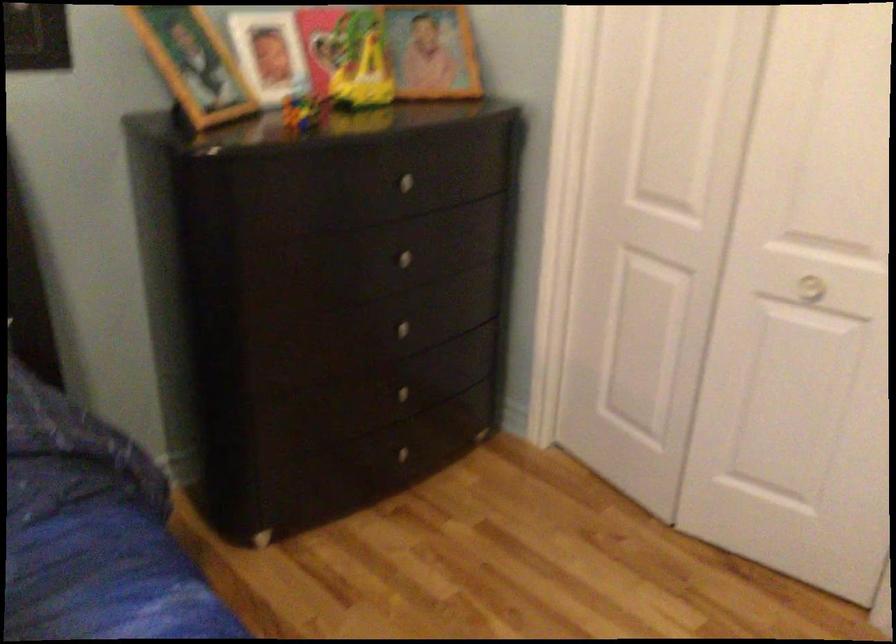
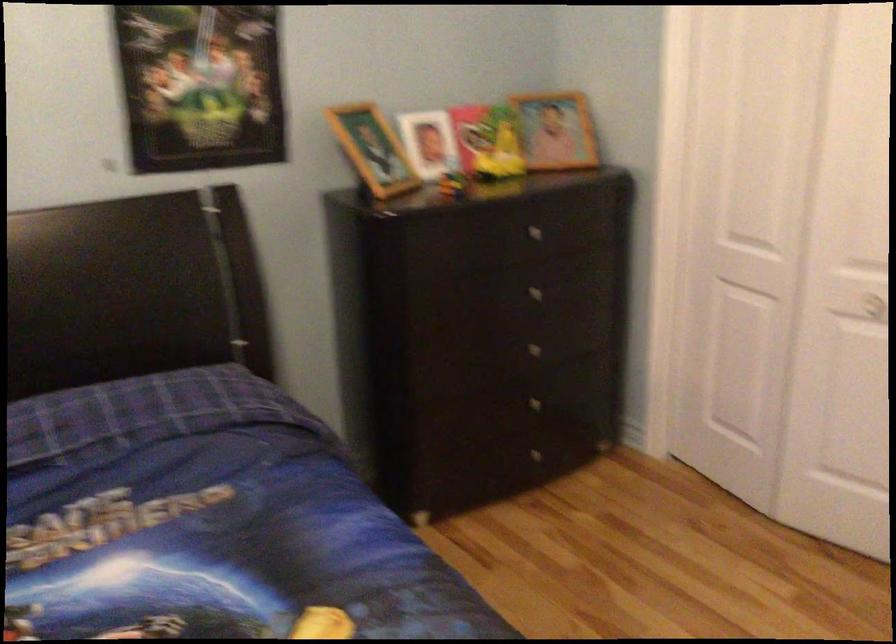
Question: Based on the continuous images, in which direction is the camera rotating? Reply with the corresponding letter.

Choices:
 (A) Left
 (B) Right
 (C) Up
 (D) Down

Answer: (A)